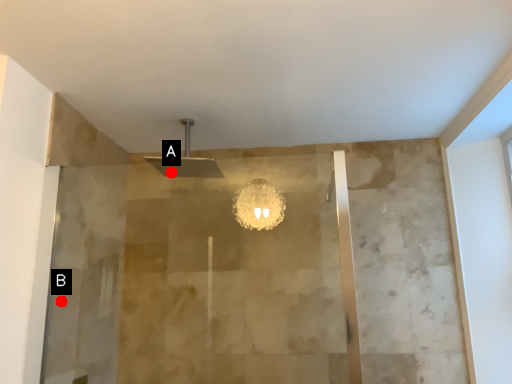
Question: Two points are circled on the image, labeled by A and B beside each circle. Which of the following is the closest to the observer?

Choices:
 (A) A is closer
 (B) B is closer

Answer: (B)